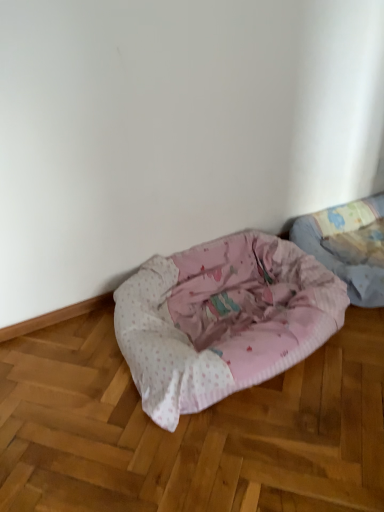
Question: Do you think pink fabric dog bed at lower right, the 2th dog bed positioned from the left, is within pink fabric dog bed at lower center, the 1th dog bed positioned from the left, or outside of it?

Choices:
 (A) inside
 (B) outside

Answer: (B)

Question: From the image's perspective, is pink fabric dog bed at lower right, the 2th dog bed positioned from the left, above or below pink fabric dog bed at lower center, the 1th dog bed positioned from the left?

Choices:
 (A) below
 (B) above

Answer: (B)

Question: From a real-world perspective, is pink fabric dog bed at lower right, the 2th dog bed positioned from the left, positioned above or below pink fabric dog bed at lower center, the second dog bed viewed from the right?

Choices:
 (A) above
 (B) below

Answer: (B)

Question: Considering the positions of pink fabric dog bed at lower center, the second dog bed viewed from the right, and pink fabric dog bed at lower right, the 2th dog bed positioned from the left, in the image, is pink fabric dog bed at lower center, the second dog bed viewed from the right, wider or thinner than pink fabric dog bed at lower right, the 2th dog bed positioned from the left,?

Choices:
 (A) thin
 (B) wide

Answer: (B)

Question: Considering the relative positions of pink fabric dog bed at lower center, the 1th dog bed positioned from the left, and pink fabric dog bed at lower right, the 2th dog bed positioned from the left, in the image provided, is pink fabric dog bed at lower center, the 1th dog bed positioned from the left, to the left or to the right of pink fabric dog bed at lower right, the 2th dog bed positioned from the left,?

Choices:
 (A) right
 (B) left

Answer: (B)

Question: Considering the positions of pink fabric dog bed at lower center, the second dog bed viewed from the right, and pink fabric dog bed at lower right, the 1th dog bed in the right-to-left sequence, in the image, is pink fabric dog bed at lower center, the second dog bed viewed from the right, taller or shorter than pink fabric dog bed at lower right, the 1th dog bed in the right-to-left sequence,?

Choices:
 (A) short
 (B) tall

Answer: (B)

Question: From a real-world perspective, relative to pink fabric dog bed at lower right, the 1th dog bed in the right-to-left sequence, is pink fabric dog bed at lower center, the second dog bed viewed from the right, vertically above or below?

Choices:
 (A) above
 (B) below

Answer: (A)